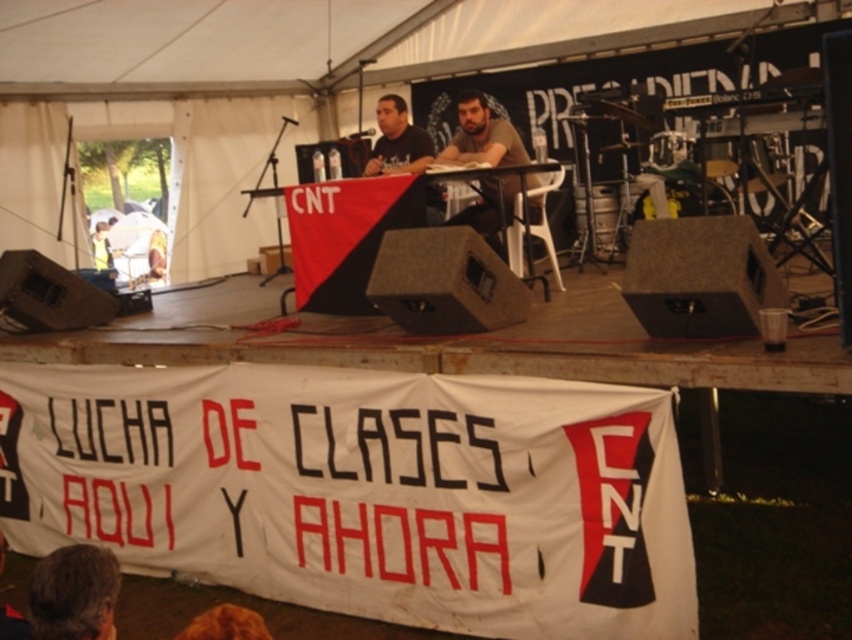
You are an event organizer at the outdoor setup. You need to place a decorative item between the brown hair at lower left and the brown fur at lower center. Considering their sizes, which object should you place closer to the front of the stage to ensure visibility?

Since the brown hair at lower left is larger than the brown fur at lower center, placing the decorative item closer to the front of the stage near the brown hair at lower left would ensure better visibility, as its larger size can command more attention from the audience.